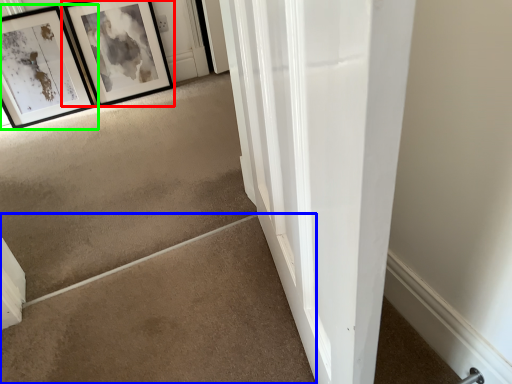
Question: Considering the real-world distances, which object is closest to picture frame (highlighted by a red box)? concrete (highlighted by a blue box) or picture frame (highlighted by a green box).

Choices:
 (A) concrete
 (B) picture frame

Answer: (B)